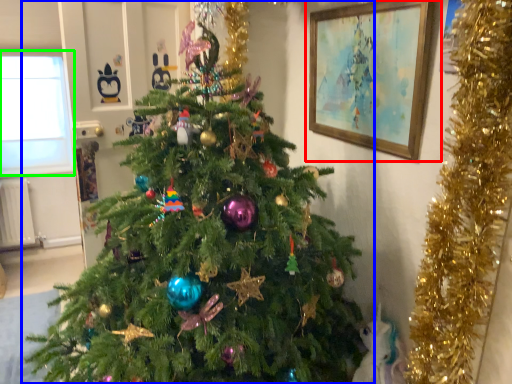
Question: Which object is the farthest from picture frame (highlighted by a red box)? Choose among these: christmas tree (highlighted by a blue box) or window screen (highlighted by a green box).

Choices:
 (A) christmas tree
 (B) window screen

Answer: (B)